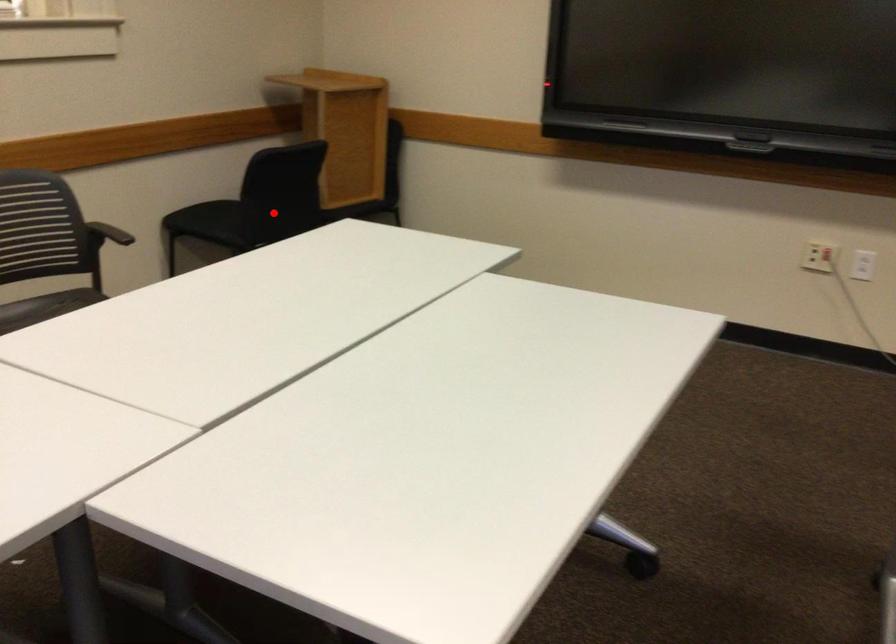
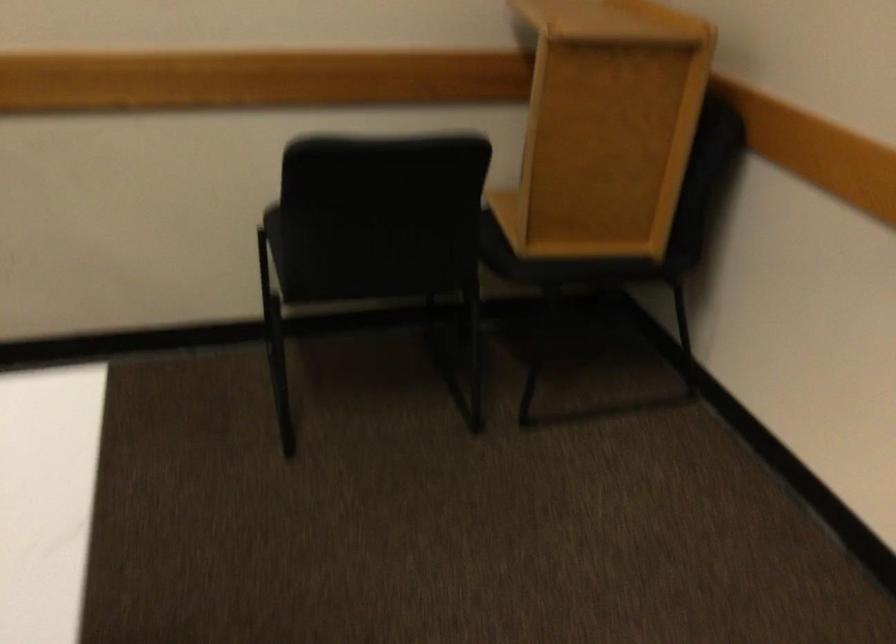
Question: I am providing you with two images of the same scene from different viewpoints. Given a red point in image1, look at the same physical point in image2. Is it:

Choices:
 (A) Closer to the viewpoint
 (B) Farther from the viewpoint

Answer: (A)